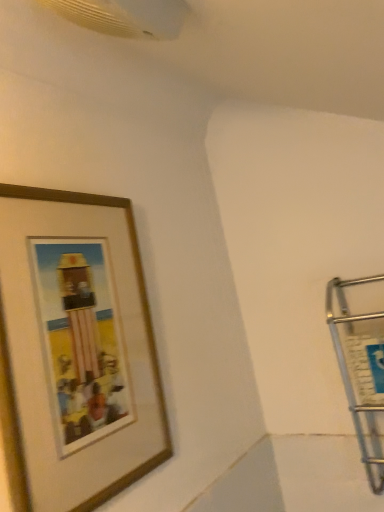
The image size is (384, 512). What do you see at coordinates (360, 371) in the screenshot?
I see `satin silver cart at right` at bounding box center [360, 371].

Identify the location of satin silver cart at right. (360, 371).

At what (x,y) coordinates should I click in order to perform the action: click on wooden picture frame at upper left. Please return your answer as a coordinate pair (x, y). Image resolution: width=384 pixels, height=512 pixels. Looking at the image, I should click on (76, 349).

Describe the element at coordinates (76, 349) in the screenshot. I see `wooden picture frame at upper left` at that location.

Locate an element on the screen. The image size is (384, 512). satin silver cart at right is located at coordinates (360, 371).

Can you confirm if wooden picture frame at upper left is positioned to the right of satin silver cart at right?

In fact, wooden picture frame at upper left is to the left of satin silver cart at right.

Which is in front, wooden picture frame at upper left or satin silver cart at right?

Positioned in front is wooden picture frame at upper left.

Between point (118, 443) and point (363, 449), which one is positioned behind?

Point (363, 449)

From the image's perspective, which is below, wooden picture frame at upper left or satin silver cart at right?

satin silver cart at right appears lower in the image.

From a real-world perspective, is wooden picture frame at upper left located beneath satin silver cart at right?

No, from a real-world perspective, wooden picture frame at upper left is not under satin silver cart at right.

Between wooden picture frame at upper left and satin silver cart at right, which one has larger width?

satin silver cart at right is wider.

Is wooden picture frame at upper left shorter than satin silver cart at right?

No, wooden picture frame at upper left is not shorter than satin silver cart at right.

Who is smaller, wooden picture frame at upper left or satin silver cart at right?

wooden picture frame at upper left is smaller.

Do you think wooden picture frame at upper left is within satin silver cart at right, or outside of it?

wooden picture frame at upper left is spatially situated outside satin silver cart at right.

Is wooden picture frame at upper left far away from satin silver cart at right?

No, wooden picture frame at upper left is not far from satin silver cart at right.

Is wooden picture frame at upper left aimed at satin silver cart at right?

No, wooden picture frame at upper left is not oriented towards satin silver cart at right.

In order to click on cart on the right of wooden picture frame at upper left in this screenshot , I will do `click(360, 371)`.

Considering the relative positions of satin silver cart at right and wooden picture frame at upper left in the image provided, is satin silver cart at right to the right of wooden picture frame at upper left from the viewer's perspective?

Indeed, satin silver cart at right is positioned on the right side of wooden picture frame at upper left.

Does satin silver cart at right lie behind wooden picture frame at upper left?

Yes, it is.

Which point is more forward, (366, 316) or (33, 434)?

Point (33, 434)

From the image's perspective, is satin silver cart at right positioned above or below wooden picture frame at upper left?

satin silver cart at right is below wooden picture frame at upper left.

From a real-world perspective, which is physically above, satin silver cart at right or wooden picture frame at upper left?

wooden picture frame at upper left, from a real-world perspective.

Does satin silver cart at right have a lesser width compared to wooden picture frame at upper left?

No.

Considering the relative sizes of satin silver cart at right and wooden picture frame at upper left in the image provided, is satin silver cart at right shorter than wooden picture frame at upper left?

Yes, satin silver cart at right is shorter than wooden picture frame at upper left.

Who is bigger, satin silver cart at right or wooden picture frame at upper left?

satin silver cart at right is bigger.

Is satin silver cart at right surrounding wooden picture frame at upper left?

That's incorrect, wooden picture frame at upper left is not inside satin silver cart at right.

Is satin silver cart at right next to wooden picture frame at upper left and touching it?

They are not placed beside each other.

Is satin silver cart at right looking in the opposite direction of wooden picture frame at upper left?

No, satin silver cart at right's orientation is not away from wooden picture frame at upper left.

Can you tell me how much satin silver cart at right and wooden picture frame at upper left differ in facing direction?

90 degrees.

Measure the distance between satin silver cart at right and wooden picture frame at upper left.

satin silver cart at right and wooden picture frame at upper left are 20.48 inches apart.

Where is `cart on the right of wooden picture frame at upper left`? This screenshot has width=384, height=512. cart on the right of wooden picture frame at upper left is located at coordinates (360, 371).

Identify the location of picture frame on the left of satin silver cart at right. (76, 349).

Find the location of `picture frame lying in front of the satin silver cart at right`. picture frame lying in front of the satin silver cart at right is located at coordinates (76, 349).